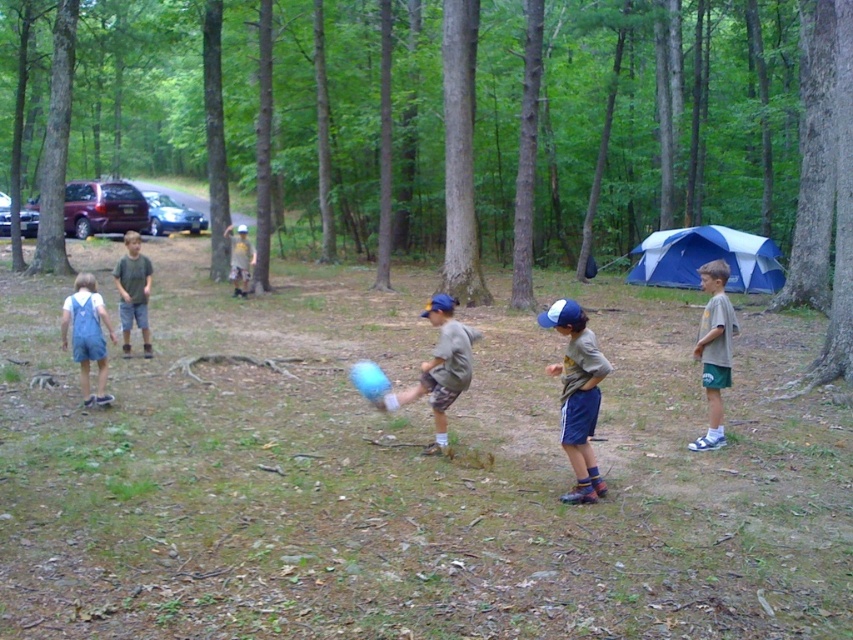
Does point (570, 388) come closer to viewer compared to point (99, 365)?

Yes, it is in front of point (99, 365).

Locate an element on the screen. blue fabric cap at center is located at coordinates (577, 396).

Is point (131, 273) positioned after point (248, 248)?

No, (131, 273) is in front of (248, 248).

Which is more to the left, light brown shorts at center or light brown wooden stick at upper center?

Positioned to the left is light brown shorts at center.

Who is more forward, (114, 269) or (245, 244)?

Point (114, 269) is in front.

Find the location of a particular element. This screenshot has width=853, height=640. light brown shorts at center is located at coordinates (132, 291).

Which is behind, point (561, 497) or point (436, 349)?

The point (436, 349) is more distant.

Which of these two, blue fabric cap at center or matte gray shirt at center, stands shorter?

matte gray shirt at center

Is point (581, 483) behind point (437, 374)?

No, (581, 483) is closer to viewer.

You are a GUI agent. You are given a task and a screenshot of the screen. Output one action in this format:
    pyautogui.click(x=<x>, y=<y>)
    Task: Click on the blue fabric cap at center
    This screenshot has height=640, width=853.
    Given the screenshot: What is the action you would take?
    pyautogui.click(x=577, y=396)